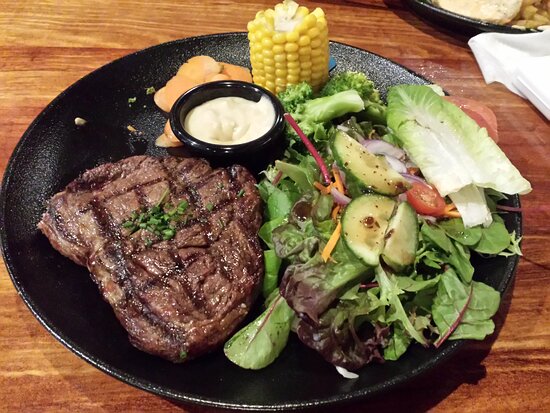
I want to click on black dip bowl, so click(x=273, y=139).